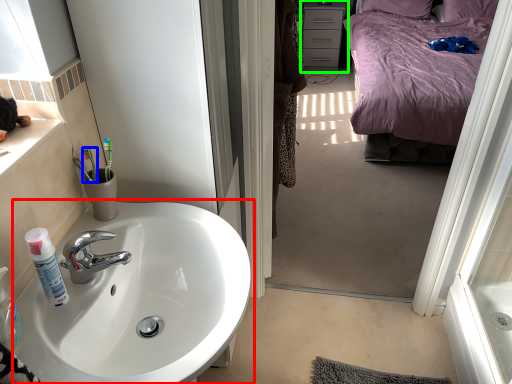
Question: Which is nearer to the sink (highlighted by a red box)? toothbrush (highlighted by a blue box) or cabinetry (highlighted by a green box).

Choices:
 (A) toothbrush
 (B) cabinetry

Answer: (A)